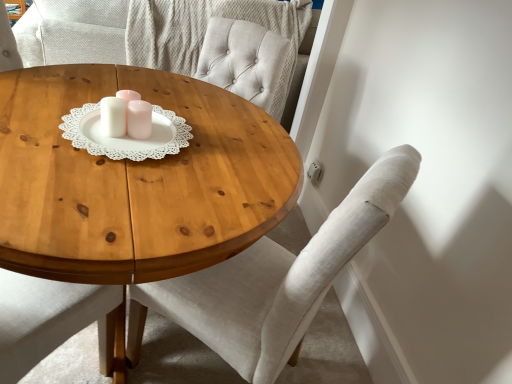
This screenshot has width=512, height=384. Find the location of `free spot in front of white glossy candle holder at center`. free spot in front of white glossy candle holder at center is located at coordinates (106, 153).